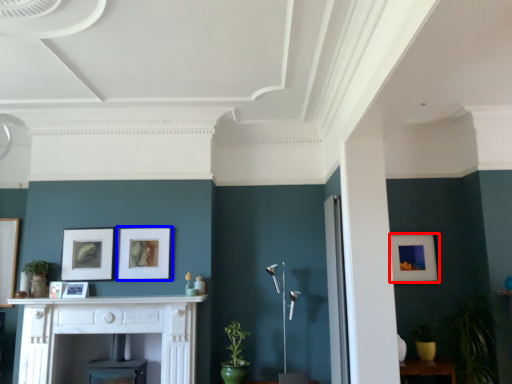
Question: Among these objects, which one is farthest to the camera, picture frame (highlighted by a red box) or picture frame (highlighted by a blue box)?

Choices:
 (A) picture frame
 (B) picture frame

Answer: (A)